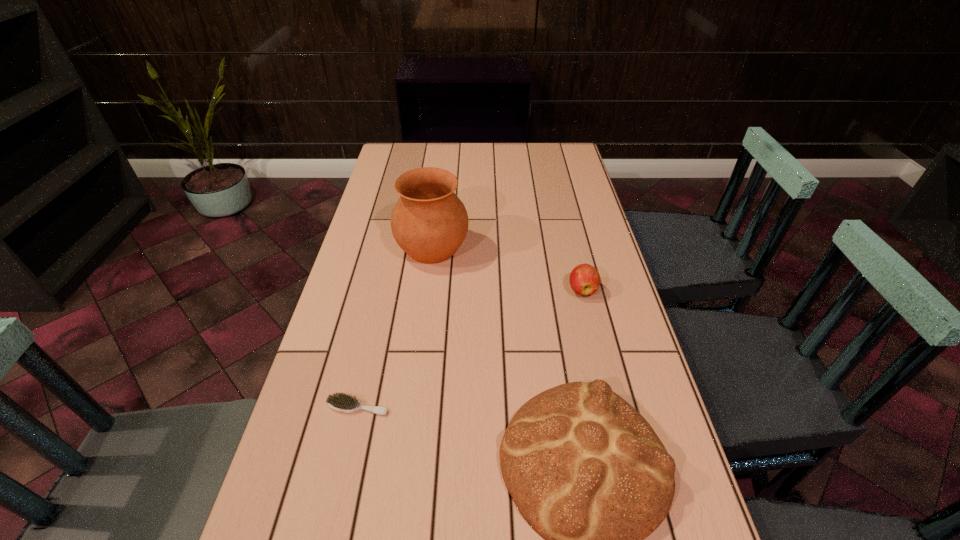
Find the location of a particular element. The image size is (960, 540). pottery is located at coordinates (429, 222).

This screenshot has width=960, height=540. I want to click on the farthest object, so click(429, 222).

Locate an element on the screen. This screenshot has width=960, height=540. apple is located at coordinates (584, 279).

Find the location of `the second shortest object`. the second shortest object is located at coordinates (584, 279).

This screenshot has height=540, width=960. I want to click on the shortest object, so click(341, 402).

Where is `blank area located 0.120m on the back of the pottery`? The width and height of the screenshot is (960, 540). blank area located 0.120m on the back of the pottery is located at coordinates (438, 205).

You are a GUI agent. You are given a task and a screenshot of the screen. Output one action in this format:
    pyautogui.click(x=<x>, y=<y>)
    Task: Click on the free space located 0.150m on the front of the apple
    
    Given the screenshot: What is the action you would take?
    pyautogui.click(x=595, y=345)

Locate an element on the screen. free spot located on the back of the shortest object is located at coordinates (368, 367).

Locate an element on the screen. Image resolution: width=960 pixels, height=540 pixels. pottery positioned at the left edge is located at coordinates pyautogui.click(x=429, y=222).

The width and height of the screenshot is (960, 540). I want to click on scrubbing brush present at the left edge, so click(x=341, y=402).